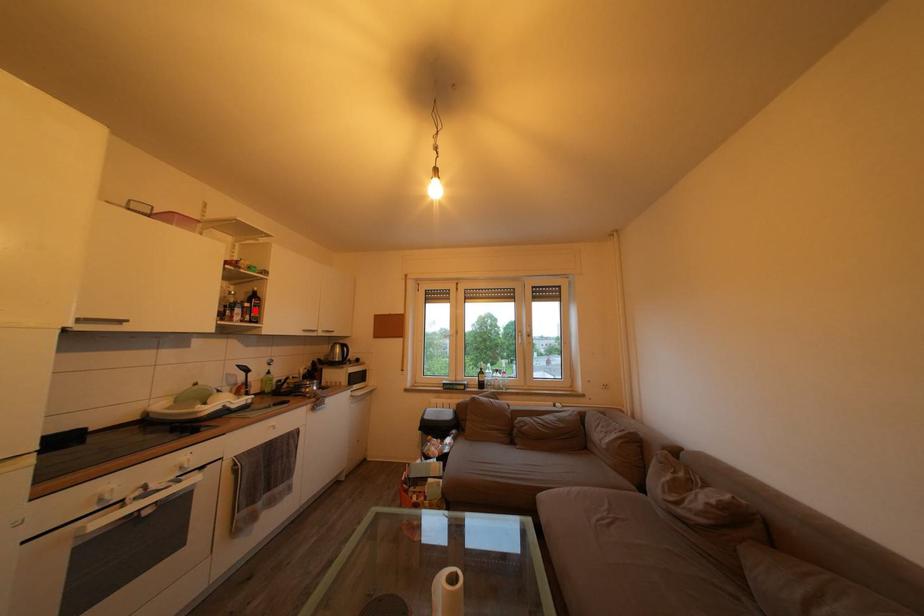
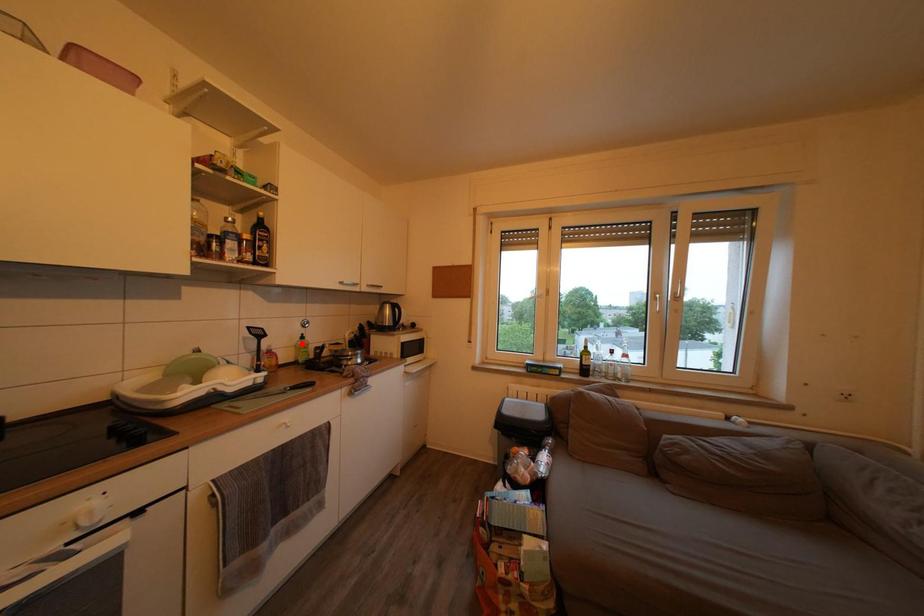
I am providing you with two images of the same scene from different viewpoints. A red point is marked on the first image and another point is marked on the second image. Does the point marked in image1 correspond to the same location as the one in image2?

No